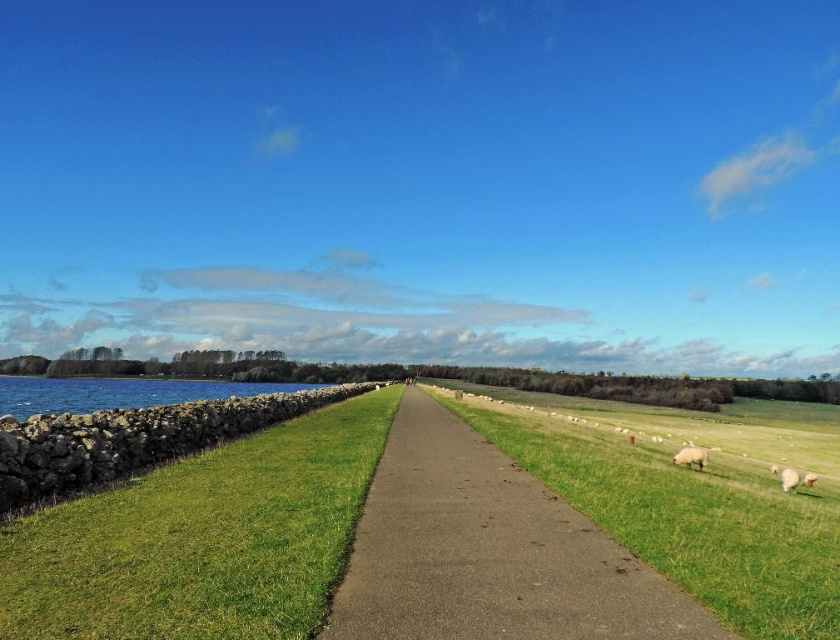
Question: Among these objects, which one is farthest from the camera?

Choices:
 (A) smooth concrete path at center
 (B) blue water at left

Answer: (B)

Question: Considering the relative positions of smooth concrete path at center and blue water at left in the image provided, where is smooth concrete path at center located with respect to blue water at left?

Choices:
 (A) above
 (B) below

Answer: (A)

Question: Considering the relative positions of white woolly sheep at lower right and white fluffy sheep at lower right in the image provided, where is white woolly sheep at lower right located with respect to white fluffy sheep at lower right?

Choices:
 (A) right
 (B) left

Answer: (B)

Question: Which point appears farthest from the camera in this image?

Choices:
 (A) (101, 385)
 (B) (675, 458)
 (C) (652, 602)
 (D) (235, 515)

Answer: (A)

Question: Which point is farther from the camera taking this photo?

Choices:
 (A) click(x=774, y=467)
 (B) click(x=705, y=458)
 (C) click(x=363, y=628)

Answer: (A)

Question: Where is green grass at left located in relation to white woolly sheep at lower right in the image?

Choices:
 (A) left
 (B) right

Answer: (A)